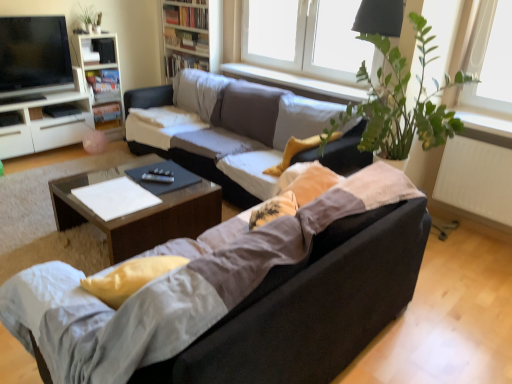
Where is `vacant space underneath matte black tv at upper left (from a real-world perspective)`? vacant space underneath matte black tv at upper left (from a real-world perspective) is located at coordinates (31, 98).